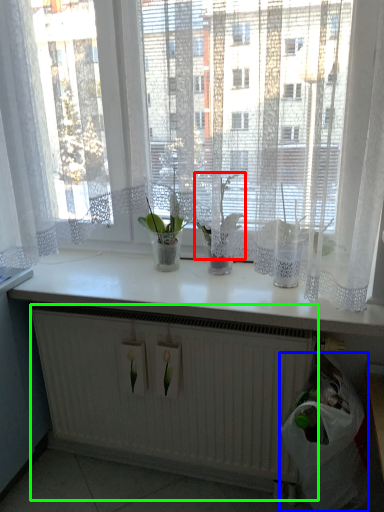
Question: Based on their relative distances, which object is nearer to orchid (highlighted by a red box)? Choose from garbage (highlighted by a blue box) and radiator (highlighted by a green box).

Choices:
 (A) garbage
 (B) radiator

Answer: (A)